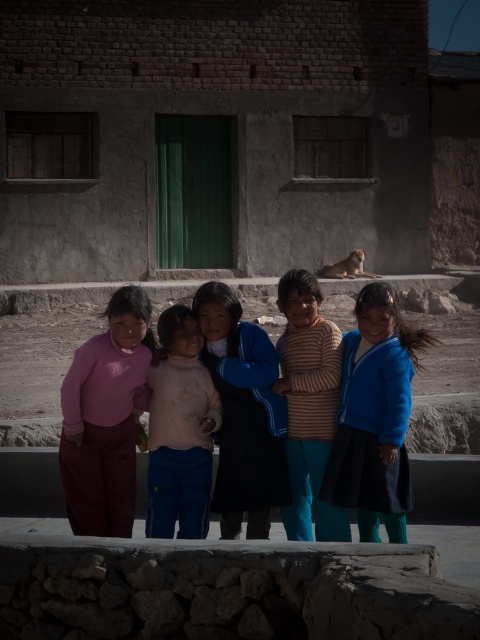
Does blue woolen sweater at center appear over white soft turtleneck sweater at center?

Yes.

Between blue woolen sweater at center and white soft turtleneck sweater at center, which one is positioned lower?

white soft turtleneck sweater at center is lower down.

What are the coordinates of `blue woolen sweater at center` in the screenshot? It's located at (242, 413).

Consider the image. Is white soft turtleneck sweater at center further to the viewer compared to striped knit sweater at center?

That is False.

Between white soft turtleneck sweater at center and striped knit sweater at center, which one appears on the left side from the viewer's perspective?

Positioned to the left is white soft turtleneck sweater at center.

Between point (184, 520) and point (297, 300), which one is positioned behind?

Positioned behind is point (297, 300).

Identify the location of white soft turtleneck sweater at center. Image resolution: width=480 pixels, height=640 pixels. (180, 429).

Does blue woolen sweater at center appear under striped knit sweater at center?

Indeed, blue woolen sweater at center is positioned under striped knit sweater at center.

Is point (252, 515) closer to camera compared to point (332, 435)?

No.

Who is more distant from viewer, (223,307) or (282,337)?

The point (282,337) is more distant.

Where is `blue woolen sweater at center`? blue woolen sweater at center is located at coordinates (242, 413).